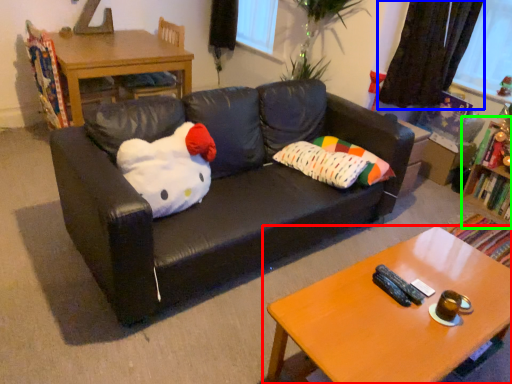
Question: Estimate the real-world distances between objects in this image. Which object is closer to coffee table (highlighted by a red box), curtain (highlighted by a blue box) or bookshelf (highlighted by a green box)?

Choices:
 (A) curtain
 (B) bookshelf

Answer: (B)